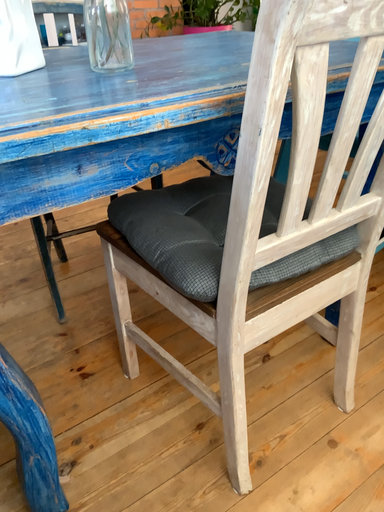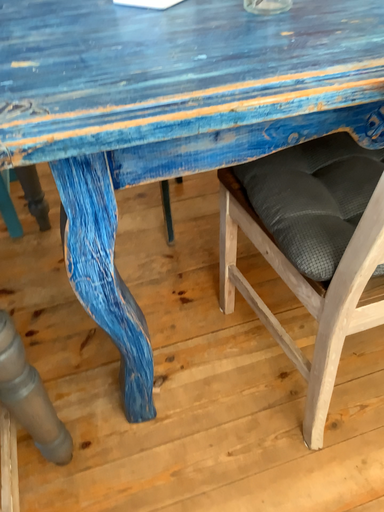
Question: Which way did the camera rotate in the video?

Choices:
 (A) rotated right
 (B) rotated left

Answer: (B)